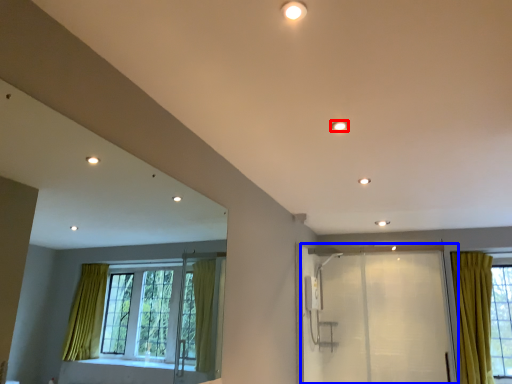
Question: Which object is closer to the camera taking this photo, lighting (highlighted by a red box) or screen door (highlighted by a blue box)?

Choices:
 (A) lighting
 (B) screen door

Answer: (A)